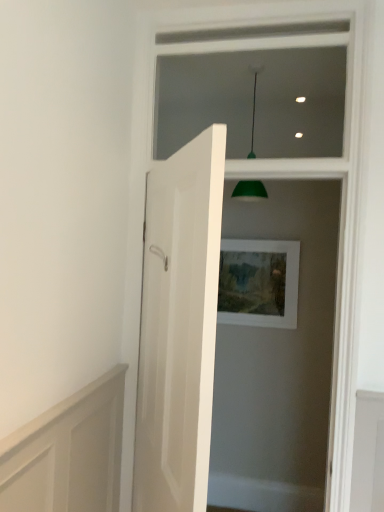
Question: Is white wood frame at upper center not close to green matte lampshade at upper center?

Choices:
 (A) yes
 (B) no

Answer: (B)

Question: Can you confirm if white wood frame at upper center is positioned to the left of green matte lampshade at upper center?

Choices:
 (A) yes
 (B) no

Answer: (A)

Question: Can you confirm if white wood frame at upper center is wider than green matte lampshade at upper center?

Choices:
 (A) no
 (B) yes

Answer: (A)

Question: Is white wood frame at upper center further to the viewer compared to green matte lampshade at upper center?

Choices:
 (A) yes
 (B) no

Answer: (B)

Question: Does white wood frame at upper center have a smaller size compared to green matte lampshade at upper center?

Choices:
 (A) no
 (B) yes

Answer: (A)

Question: Considering the positions of point (269, 268) and point (253, 126), is point (269, 268) closer or farther from the camera than point (253, 126)?

Choices:
 (A) closer
 (B) farther

Answer: (A)

Question: From a real-world perspective, relative to green matte lampshade at upper center, is white matte picture frame at center vertically above or below?

Choices:
 (A) below
 (B) above

Answer: (A)

Question: Is white matte picture frame at center bigger or smaller than green matte lampshade at upper center?

Choices:
 (A) small
 (B) big

Answer: (A)

Question: Is white matte picture frame at center inside the boundaries of green matte lampshade at upper center, or outside?

Choices:
 (A) inside
 (B) outside

Answer: (B)

Question: Looking at the image, does white wood frame at upper center seem bigger or smaller compared to white glossy door at center?

Choices:
 (A) small
 (B) big

Answer: (A)

Question: Looking at their shapes, would you say white wood frame at upper center is wider or thinner than white glossy door at center?

Choices:
 (A) thin
 (B) wide

Answer: (A)

Question: From the image's perspective, is white wood frame at upper center positioned above or below white glossy door at center?

Choices:
 (A) above
 (B) below

Answer: (A)

Question: Is white wood frame at upper center spatially inside white glossy door at center, or outside of it?

Choices:
 (A) outside
 (B) inside

Answer: (A)

Question: Is white wood frame at upper center inside or outside of white matte picture frame at center?

Choices:
 (A) outside
 (B) inside

Answer: (A)

Question: Is white wood frame at upper center wider or thinner than white matte picture frame at center?

Choices:
 (A) wide
 (B) thin

Answer: (A)